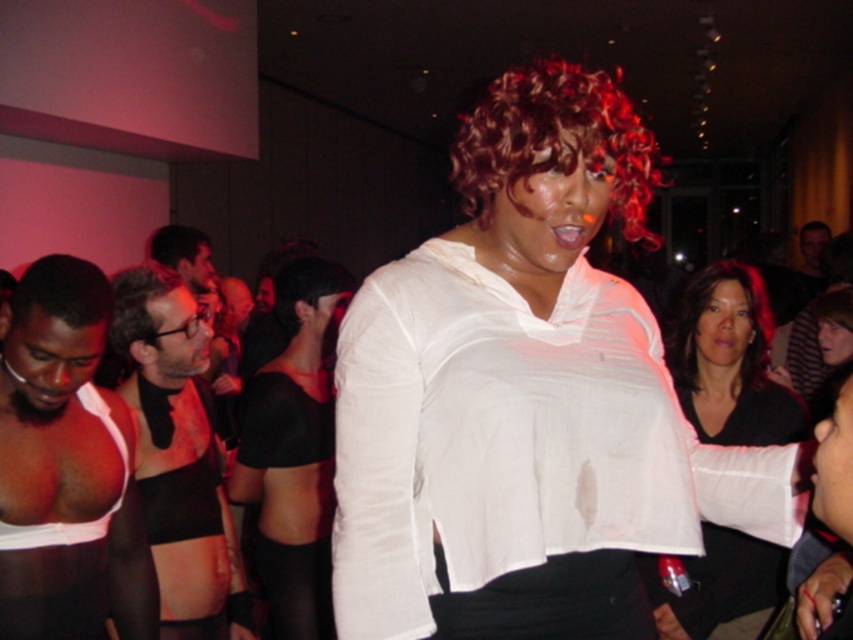
Question: Which of the following is the farthest from the observer?

Choices:
 (A) matte black arm at center
 (B) black sheer top at center
 (C) curly brown wig at center

Answer: (B)

Question: Is black sheer top at center above curly brown wig at center?

Choices:
 (A) no
 (B) yes

Answer: (A)

Question: Among these points, which one is farthest from the camera?

Choices:
 (A) (706, 600)
 (B) (367, 515)
 (C) (567, 152)

Answer: (A)

Question: Which point appears farthest from the camera in this image?

Choices:
 (A) (660, 456)
 (B) (322, 374)
 (C) (554, 104)
 (D) (747, 362)

Answer: (B)

Question: Where is matte black arm at center located in relation to curly brown wig at center in the image?

Choices:
 (A) left
 (B) right

Answer: (A)

Question: Considering the relative positions of black sheer top at center and matte black arm at center in the image provided, where is black sheer top at center located with respect to matte black arm at center?

Choices:
 (A) below
 (B) above

Answer: (A)